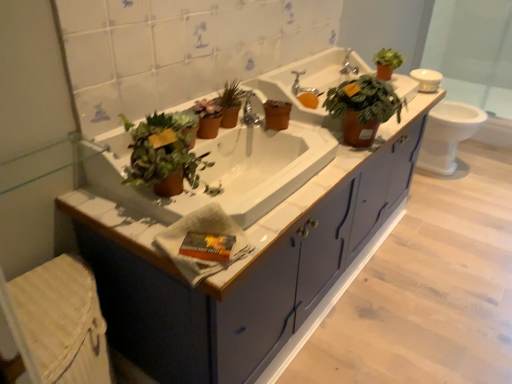
Question: Can you confirm if white textured hand towel at center is positioned to the left of matte blue cabinet at center?

Choices:
 (A) yes
 (B) no

Answer: (A)

Question: Can we say white textured hand towel at center lies outside matte blue cabinet at center?

Choices:
 (A) yes
 (B) no

Answer: (A)

Question: Is matte blue cabinet at center at the back of white textured hand towel at center?

Choices:
 (A) no
 (B) yes

Answer: (A)

Question: Considering the relative positions of white textured hand towel at center and matte blue cabinet at center in the image provided, is white textured hand towel at center in front of matte blue cabinet at center?

Choices:
 (A) yes
 (B) no

Answer: (A)

Question: From the image's perspective, does white textured hand towel at center appear lower than matte blue cabinet at center?

Choices:
 (A) yes
 (B) no

Answer: (A)

Question: In terms of width, does matte blue cabinet at center look wider or thinner when compared to matte blue cabinet at center?

Choices:
 (A) wide
 (B) thin

Answer: (A)

Question: From the image's perspective, is matte blue cabinet at center above or below matte blue cabinet at center?

Choices:
 (A) above
 (B) below

Answer: (A)

Question: Is matte blue cabinet at center inside the boundaries of matte blue cabinet at center, or outside?

Choices:
 (A) inside
 (B) outside

Answer: (B)

Question: From a real-world perspective, relative to matte blue cabinet at center, is matte blue cabinet at center vertically above or below?

Choices:
 (A) below
 (B) above

Answer: (B)

Question: Choose the correct answer: Is matte terracotta pot at upper right, which ranks as the 1th houseplant in front-to-back order, inside matte ceramic sink at center, the 1th sink in the back-to-front sequence, or outside it?

Choices:
 (A) inside
 (B) outside

Answer: (B)

Question: Considering the positions of point (369, 92) and point (315, 112), is point (369, 92) closer or farther from the camera than point (315, 112)?

Choices:
 (A) closer
 (B) farther

Answer: (A)

Question: In terms of height, does matte terracotta pot at upper right, which ranks as the 1th houseplant in front-to-back order, look taller or shorter compared to matte ceramic sink at center, the 1th sink in the back-to-front sequence?

Choices:
 (A) short
 (B) tall

Answer: (A)

Question: Considering the positions of matte terracotta pot at upper right, positioned as the third houseplant in left-to-right order, and matte ceramic sink at center, the 1th sink in the back-to-front sequence, in the image, is matte terracotta pot at upper right, positioned as the third houseplant in left-to-right order, bigger or smaller than matte ceramic sink at center, the 1th sink in the back-to-front sequence,?

Choices:
 (A) big
 (B) small

Answer: (B)

Question: From a real-world perspective, is matte brown pot at center, which is the 2th houseplant in left-to-right order, physically located above or below white glossy sink at center, which is the 1th sink in front-to-back order?

Choices:
 (A) above
 (B) below

Answer: (A)

Question: Visually, is matte brown pot at center, which ranks as the third houseplant in right-to-left order, positioned to the left or to the right of white glossy sink at center, which ranks as the second sink in back-to-front order?

Choices:
 (A) left
 (B) right

Answer: (A)